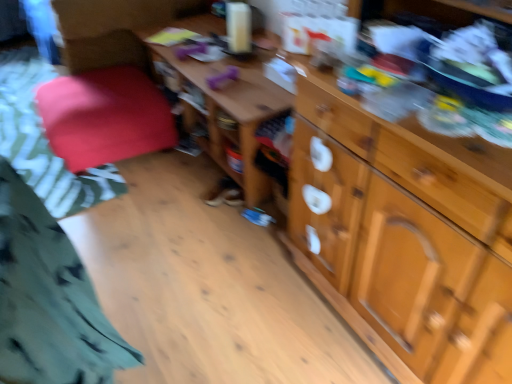
Question: Visually, is wooden drawer at right positioned to the left or to the right of wooden table at center?

Choices:
 (A) right
 (B) left

Answer: (A)

Question: Considering the positions of wooden drawer at right and wooden table at center in the image, is wooden drawer at right wider or thinner than wooden table at center?

Choices:
 (A) thin
 (B) wide

Answer: (A)

Question: Considering the real-world distances, which object is farthest from the velvet red cushion at left?

Choices:
 (A) velvet red cushion at left
 (B) green cotton shirt at lower left
 (C) wooden cabinet at right
 (D) wooden table at center
 (E) wooden drawer at right

Answer: (B)

Question: Estimate the real-world distances between objects in this image. Which object is closer to the wooden table at center?

Choices:
 (A) green cotton shirt at lower left
 (B) wooden drawer at right
 (C) velvet red cushion at left
 (D) wooden cabinet at right
 (E) velvet red cushion at left

Answer: (C)